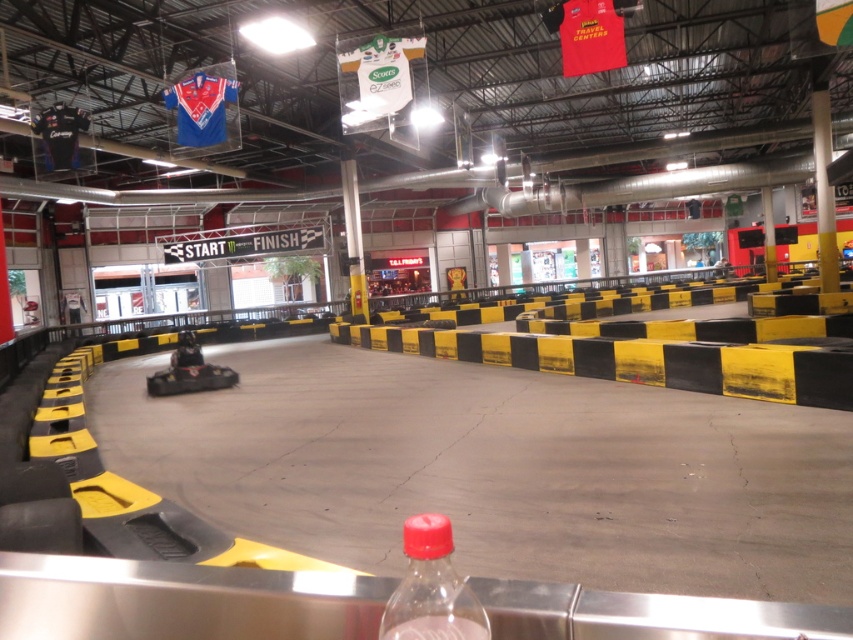
You are standing at the starting line of the go kart track and want to reach the point marked at coordinates point (x=744, y=410). The track is 6 meters wide. Can you drive straight to the point without crossing the track boundaries?

The point (x=744, y=410) is 6.38 meters away from the camera. Since the track is 6 meters wide, driving straight would require staying within the 6 meter width. However, the distance to the point is 6.38 meters, which exceeds the track width. Therefore, you would need to adjust your path to stay within the track boundaries.